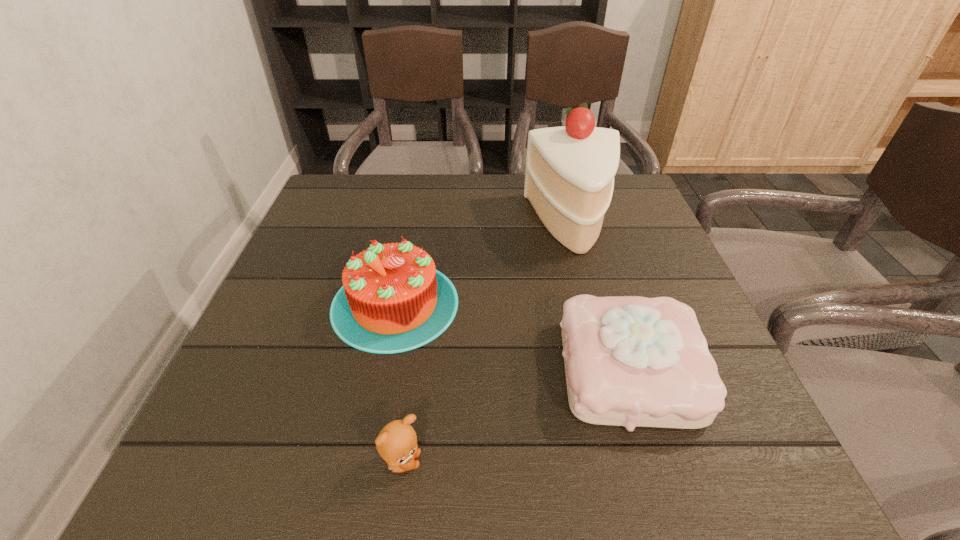
Where is `object present at the far edge`? This screenshot has width=960, height=540. object present at the far edge is located at coordinates (569, 180).

You are a GUI agent. You are given a task and a screenshot of the screen. Output one action in this format:
    pyautogui.click(x=<x>, y=<y>)
    Task: Click on the cake that is at the near edge
    
    Given the screenshot: What is the action you would take?
    pyautogui.click(x=630, y=361)

Where is `teddy bear that is at the near edge`? The height and width of the screenshot is (540, 960). teddy bear that is at the near edge is located at coordinates (397, 442).

Where is `object situated at the left edge`? Image resolution: width=960 pixels, height=540 pixels. object situated at the left edge is located at coordinates (393, 300).

Where is `object located at the far right corner`? object located at the far right corner is located at coordinates (569, 180).

Find the location of a particular element. The width and height of the screenshot is (960, 540). object situated at the near right corner is located at coordinates (630, 361).

Identify the location of vacant space at the far edge of the desktop. The image size is (960, 540). (459, 183).

Where is `free point at the left edge`? This screenshot has height=540, width=960. free point at the left edge is located at coordinates (300, 262).

This screenshot has width=960, height=540. I want to click on free spot at the far left corner of the desktop, so click(x=352, y=221).

Identify the location of vacant space at the near left corner. This screenshot has width=960, height=540. (251, 433).